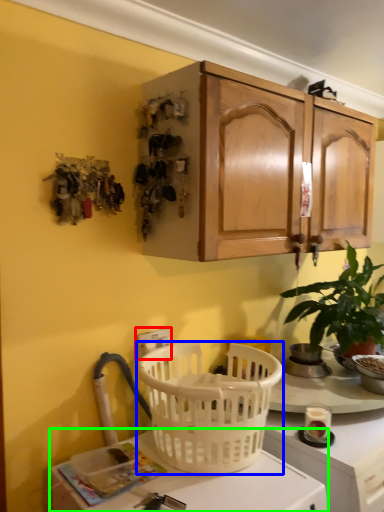
Question: Which object is positioned farthest from electric outlet (highlighted by a red box)? Select from picnic basket (highlighted by a blue box) and desk (highlighted by a green box).

Choices:
 (A) picnic basket
 (B) desk

Answer: (B)